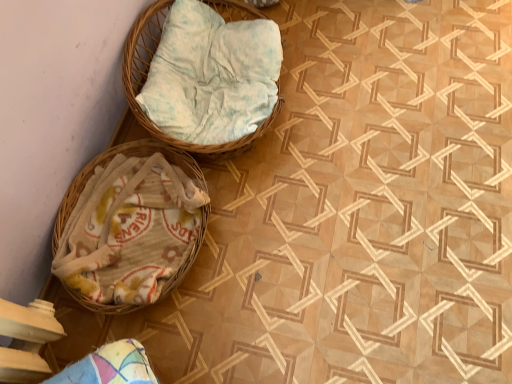
I want to click on vacant space to the right of white woven basket at left, which appears as the 1th basket when ordered from the bottom, so click(x=282, y=246).